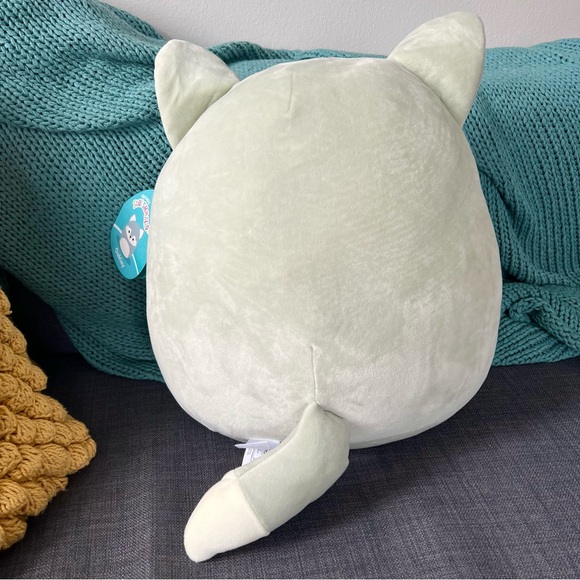
Where is `pillow`? The height and width of the screenshot is (580, 580). pillow is located at coordinates (37, 406).